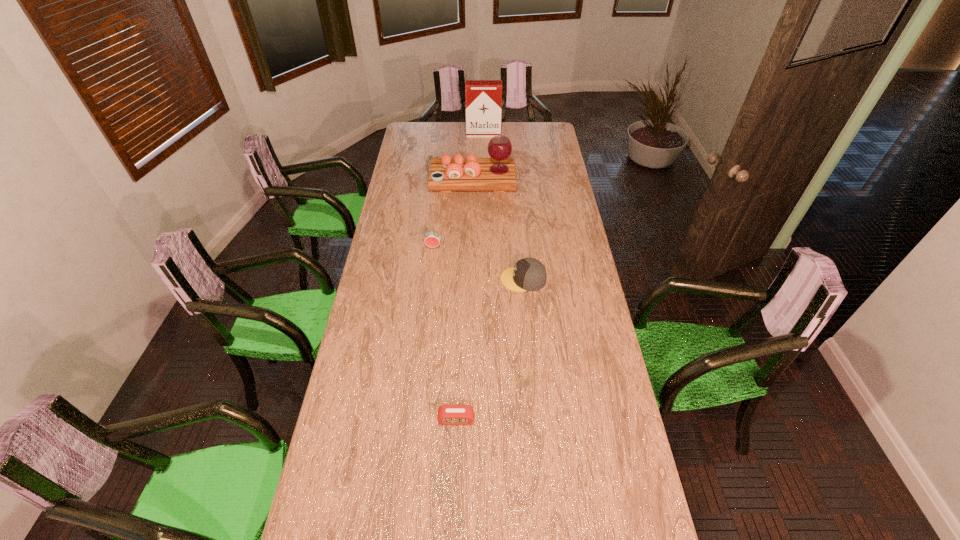
This screenshot has height=540, width=960. What are the coordinates of `free location at the right edge` in the screenshot? It's located at (540, 165).

Image resolution: width=960 pixels, height=540 pixels. What are the coordinates of `free point between the taller alarm clock and the nearest object` in the screenshot? It's located at (444, 333).

Identify the location of empty space that is in between the second tallest object and the cap. Image resolution: width=960 pixels, height=540 pixels. (498, 230).

Locate an element on the screen. The image size is (960, 540). unoccupied area between the left alarm clock and the second farthest object is located at coordinates (453, 213).

Identify the location of vacant space in between the right alarm clock and the farthest object. (469, 277).

At what (x,y) coordinates should I click in order to perform the action: click on free space between the third tallest object and the right alarm clock. Please return your answer as a coordinate pair (x, y). This screenshot has width=960, height=540. Looking at the image, I should click on (444, 333).

The width and height of the screenshot is (960, 540). I want to click on unoccupied position between the shorter alarm clock and the platter, so [465, 299].

Identify the location of the third closest object relative to the third tallest object. (447, 414).

Find the location of a particular element. The image size is (960, 540). the closest object to the right alarm clock is located at coordinates (528, 274).

This screenshot has height=540, width=960. In order to click on free space that satisfies the following two spatial constraints: 1. on the front-facing side of the second shortest object; 2. on the front-facing side of the shortest object in this screenshot , I will do `click(537, 419)`.